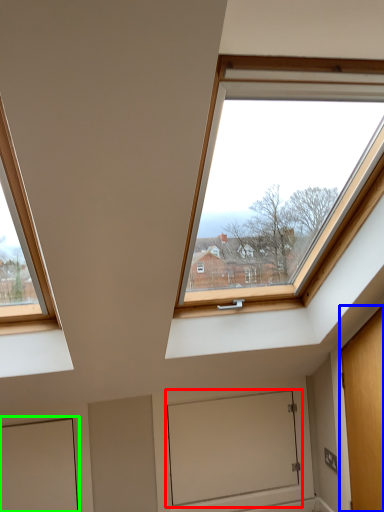
Question: Considering the real-world distances, which object is farthest from window screen (highlighted by a red box)? door (highlighted by a blue box) or door (highlighted by a green box)?

Choices:
 (A) door
 (B) door

Answer: (B)